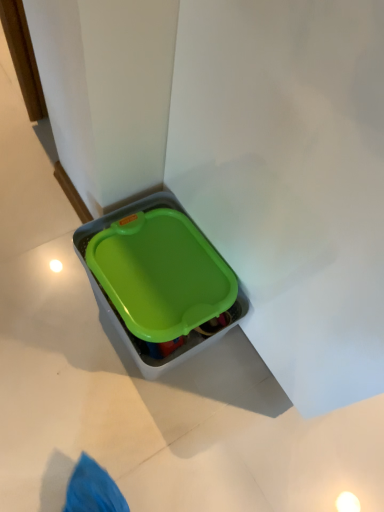
Identify the location of unoccupied area in front of green plastic container at lower left. coord(114,404).